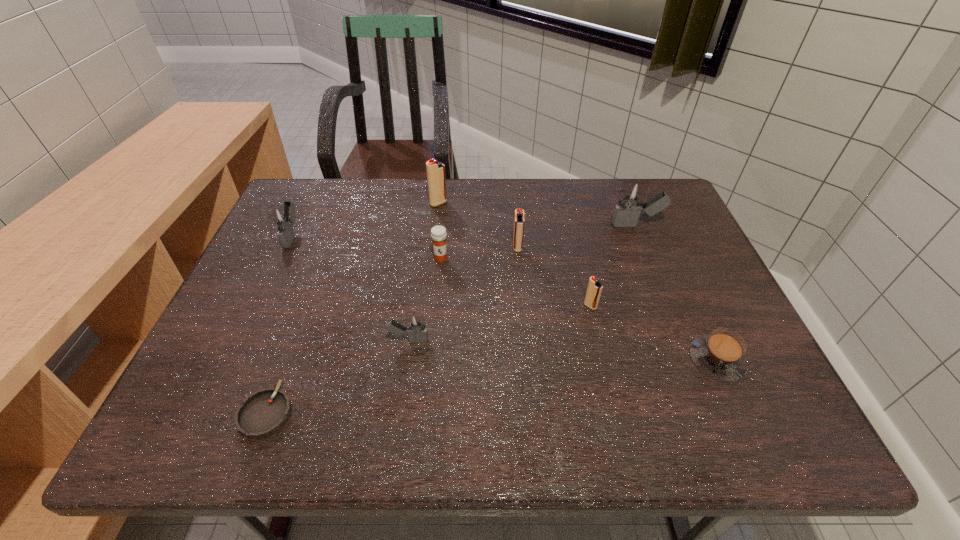
What are the coordinates of `free space between the brown cappuccino and the second red igniter from right to left` in the screenshot? It's located at (617, 304).

Locate an element on the screen. free space between the nearest gray igniter and the rightmost gray igniter is located at coordinates point(522,283).

Where is `free space that is in between the leftmost gray igniter and the leftmost red igniter`? The width and height of the screenshot is (960, 540). free space that is in between the leftmost gray igniter and the leftmost red igniter is located at coordinates (366, 219).

Image resolution: width=960 pixels, height=540 pixels. In order to click on free space between the fourth object from right to left and the nearest igniter in this screenshot , I will do `click(463, 294)`.

This screenshot has width=960, height=540. I want to click on empty space between the second red igniter from right to left and the nearest red igniter, so click(554, 277).

The image size is (960, 540). What are the coordinates of `free space between the smallest gray igniter and the nearest object` in the screenshot? It's located at (338, 376).

This screenshot has width=960, height=540. In order to click on empty location between the leftmost object and the gray ashtray in this screenshot , I will do [279, 323].

The width and height of the screenshot is (960, 540). I want to click on object identified as the sixth closest to the leftmost gray igniter, so click(594, 289).

Point out which object is positioned as the fourth nearest to the nearest gray igniter. Please provide its 2D coordinates. Your answer should be formatted as a tuple, i.e. [(x, y)], where the tuple contains the x and y coordinates of a point satisfying the conditions above.

[(594, 289)]

Select which igniter appears as the fifth closest to the nearest igniter. Please provide its 2D coordinates. Your answer should be formatted as a tuple, i.e. [(x, y)], where the tuple contains the x and y coordinates of a point satisfying the conditions above.

[(631, 198)]